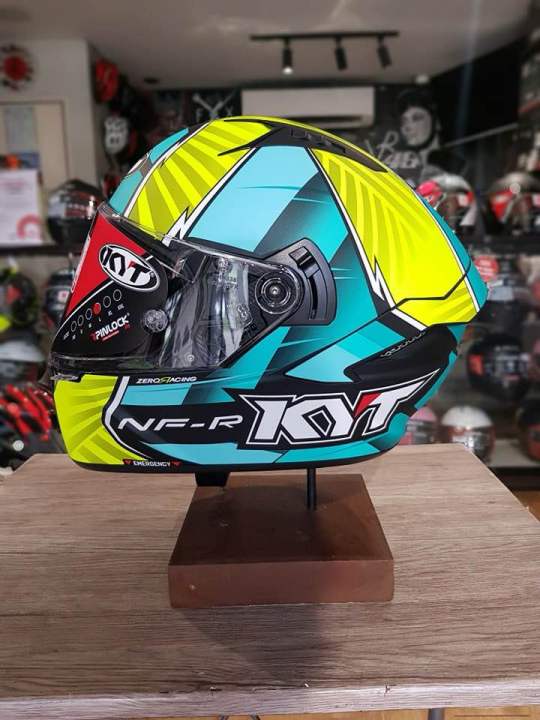
You are a GUI agent. You are given a task and a screenshot of the screen. Output one action in this format:
    pyautogui.click(x=<x>, y=<y>)
    Task: Click on the walls
    
    Given the screenshot: What is the action you would take?
    pyautogui.click(x=505, y=93), pyautogui.click(x=396, y=106), pyautogui.click(x=100, y=117), pyautogui.click(x=60, y=73)